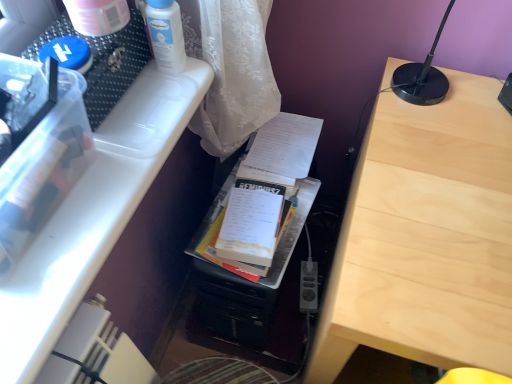
What are the coordinates of `vacant area on top of white paper at center (from a real-world perspective)` in the screenshot? It's located at pos(286,137).